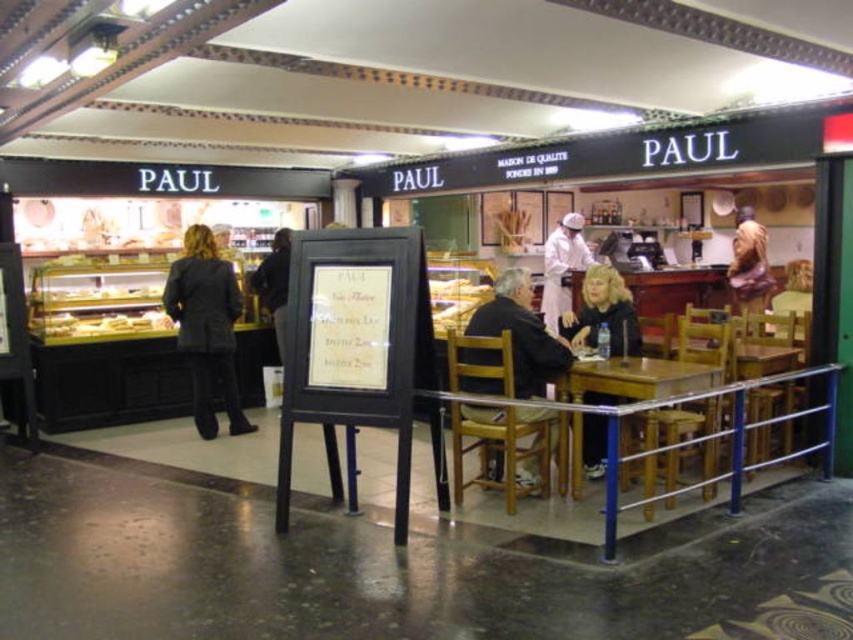
Question: Is dark gray suit at left to the left of white uniform at center from the viewer's perspective?

Choices:
 (A) no
 (B) yes

Answer: (B)

Question: Which of the following is the closest to the observer?

Choices:
 (A) (567, 291)
 (B) (541, 365)

Answer: (B)

Question: Does wooden table at center lie in front of smooth beige shirt at center?

Choices:
 (A) no
 (B) yes

Answer: (B)

Question: Considering the real-world distances, which object is closest to the dark gray suit at left?

Choices:
 (A) wooden table at center
 (B) blonde hair at table center
 (C) wooden statue at center
 (D) white uniform at center

Answer: (B)

Question: Which is farther from the wooden table at center?

Choices:
 (A) wooden statue at center
 (B) blonde hair at table center

Answer: (A)

Question: Does dark brown wooden chair at center come in front of white uniform at center?

Choices:
 (A) no
 (B) yes

Answer: (B)